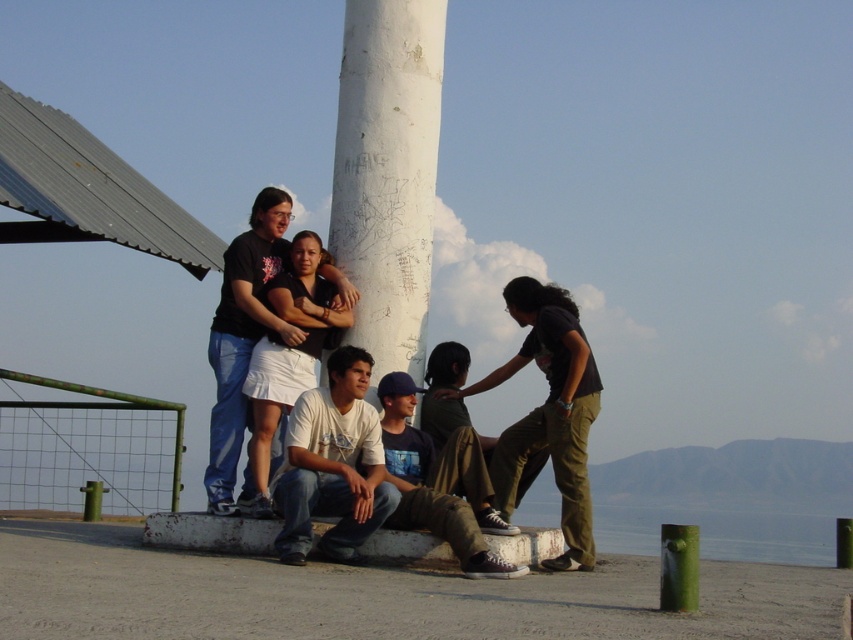
Question: Which point is closer to the camera taking this photo?

Choices:
 (A) (434, 52)
 (B) (549, 388)
 (C) (224, 300)

Answer: (B)

Question: Does green rusted metal fence at lower left come behind matte black shirt at upper left?

Choices:
 (A) yes
 (B) no

Answer: (A)

Question: Considering the real-world distances, which object is farthest from the green rusted metal fence at lower left?

Choices:
 (A) matte black shirt at center
 (B) matte black shirt at upper left
 (C) white matte pillar at center
 (D) white cotton shirt at center

Answer: (A)

Question: Which object is the farthest from the matte black shirt at center?

Choices:
 (A) green rusted metal fence at lower left
 (B) white cotton shirt at center
 (C) dark blue cotton shirt at center

Answer: (A)

Question: Considering the relative positions of green rusted metal fence at lower left and white cotton shirt at center in the image provided, where is green rusted metal fence at lower left located with respect to white cotton shirt at center?

Choices:
 (A) below
 (B) above

Answer: (B)

Question: Can you confirm if green rusted metal fence at lower left is positioned below matte black shirt at center?

Choices:
 (A) no
 (B) yes

Answer: (A)